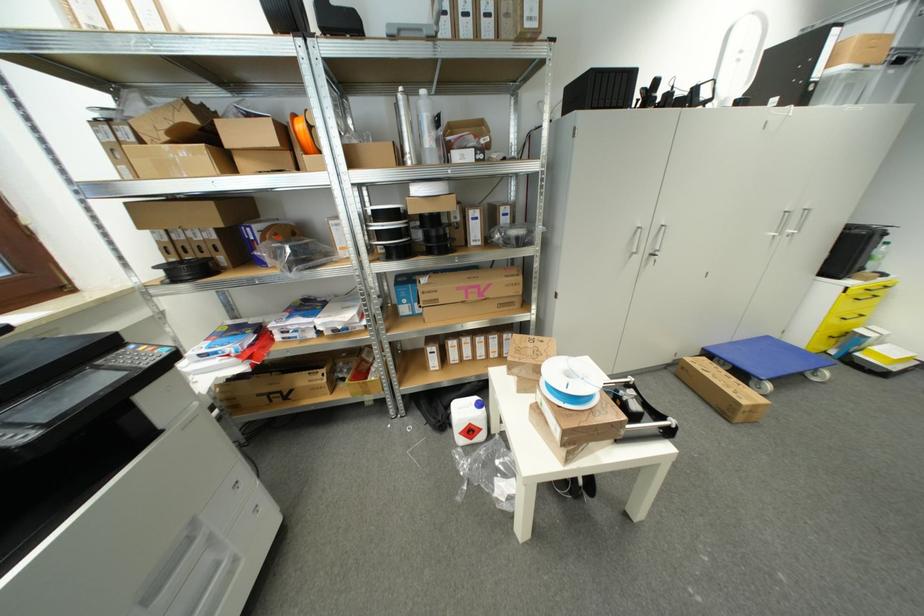
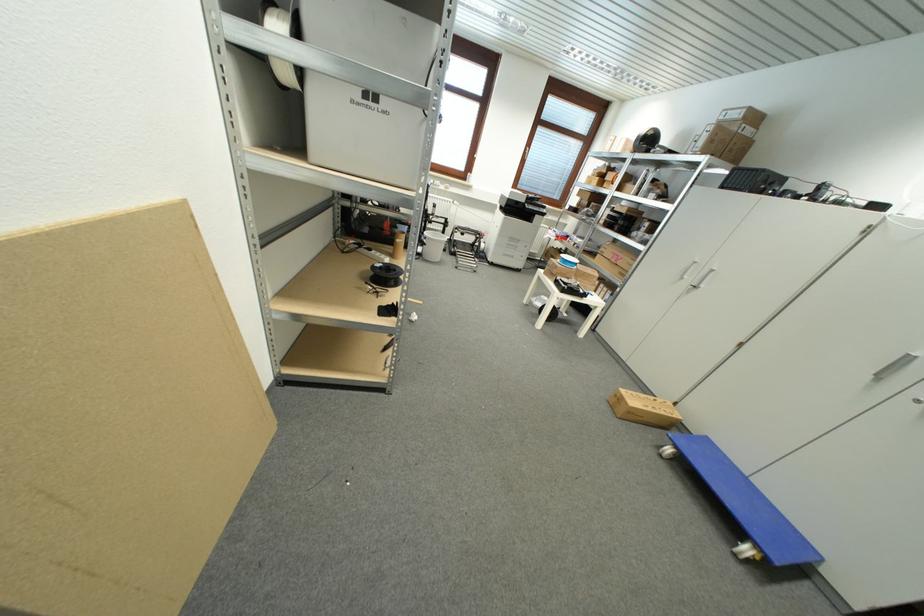
The point at (484,296) is marked in the first image. Where is the corresponding point in the second image?

(621, 262)